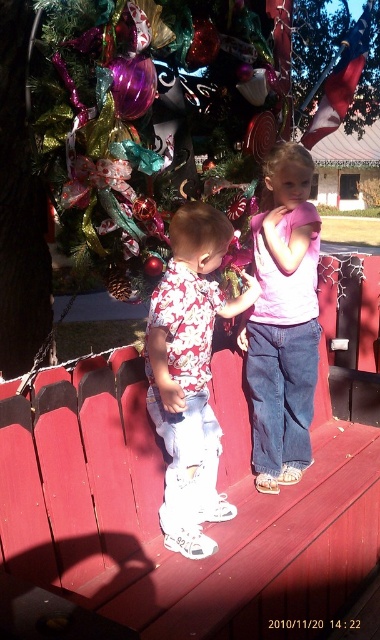
Question: Which point is closer to the camera taking this photo?

Choices:
 (A) (158, 204)
 (B) (294, 230)
 (C) (161, 358)

Answer: (C)

Question: Which object appears farthest from the camera in this image?

Choices:
 (A) shiny metallic ornaments at center
 (B) pink cotton shirt at center
 (C) metallic red flag at upper center
 (D) floral fabric shirt at center

Answer: (C)

Question: Does pink cotton shirt at center have a smaller size compared to metallic red flag at upper center?

Choices:
 (A) yes
 (B) no

Answer: (A)

Question: Which of the following is the closest to the observer?

Choices:
 (A) floral fabric shirt at center
 (B) metallic red flag at upper center
 (C) pink cotton shirt at center
 (D) shiny metallic ornaments at center

Answer: (A)

Question: From the image, what is the correct spatial relationship of shiny metallic ornaments at center in relation to metallic red flag at upper center?

Choices:
 (A) left
 (B) right

Answer: (A)

Question: Does shiny metallic ornaments at center have a lesser width compared to metallic red flag at upper center?

Choices:
 (A) yes
 (B) no

Answer: (B)